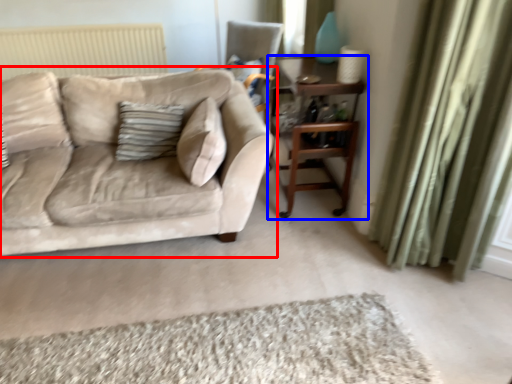
Question: Which object appears closest to the camera in this image, studio couch (highlighted by a red box) or table (highlighted by a blue box)?

Choices:
 (A) studio couch
 (B) table

Answer: (A)